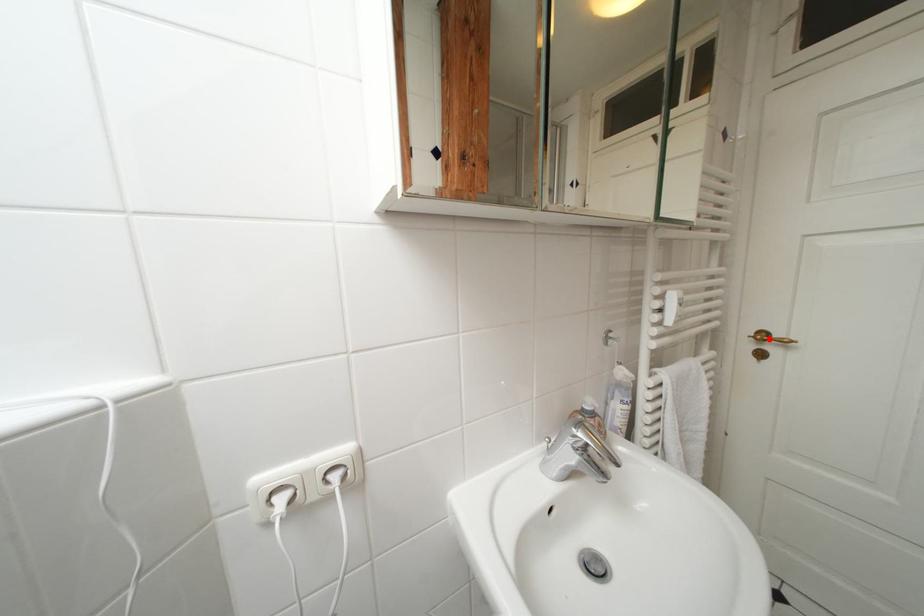
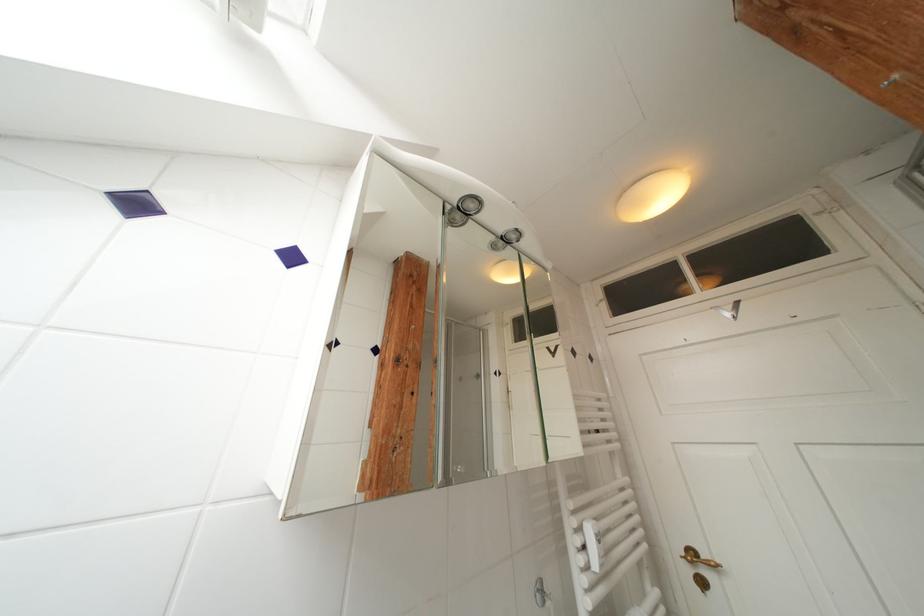
Find the pixel in the second image that matches the highlighted location in the first image.

(699, 557)